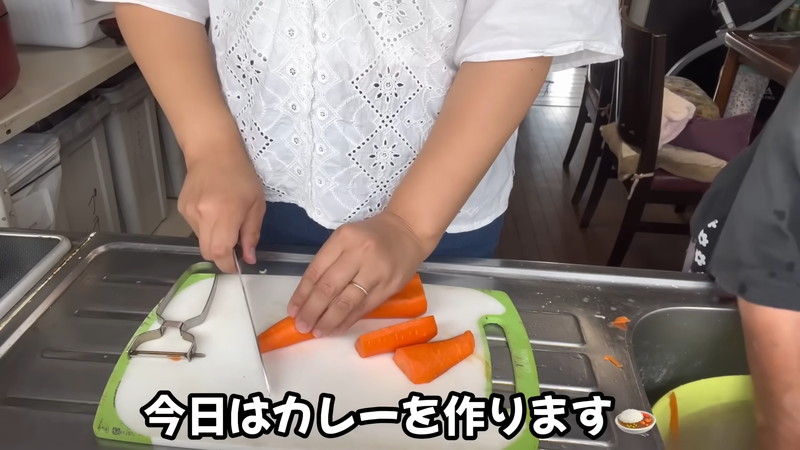
Identify the location of soup bowl emoji icon. The image size is (800, 450). (630, 423).